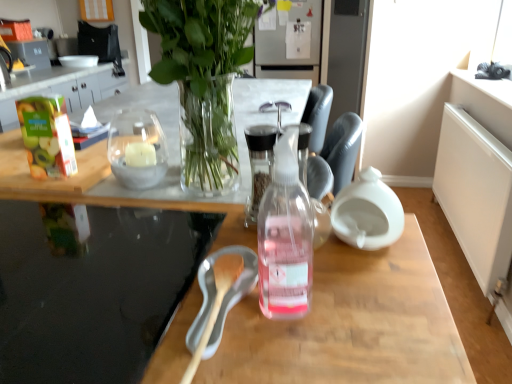
Identify the location of free spot to the right of clear glass bottle at center. This screenshot has width=512, height=384. (372, 302).